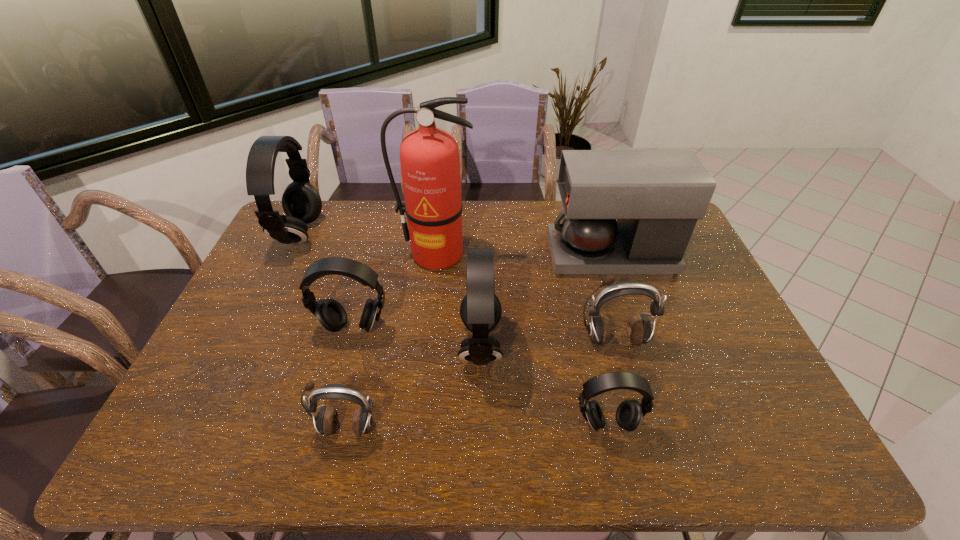
Where is `the smallest black earphone`? This screenshot has width=960, height=540. the smallest black earphone is located at coordinates (629, 413).

The height and width of the screenshot is (540, 960). Identify the location of the nearest black earphone. (629, 413).

Where is `the left brown earphone`? the left brown earphone is located at coordinates (326, 421).

Locate an element on the screen. Image resolution: width=960 pixels, height=540 pixels. the nearer brown earphone is located at coordinates [x=326, y=421].

The width and height of the screenshot is (960, 540). What are the coordinates of `vacant region located 0.290m on the side of the red fire extinguisher with the nozzle and handle` in the screenshot? It's located at (426, 343).

This screenshot has width=960, height=540. I want to click on free spot located on the ear cups of the tallest earphone, so click(x=371, y=235).

Find the location of a particular element. vacant position located 0.180m on the carafe side of the coffee maker is located at coordinates (496, 255).

The width and height of the screenshot is (960, 540). I want to click on free spot located 0.280m on the carafe side of the coffee maker, so click(467, 255).

The width and height of the screenshot is (960, 540). I want to click on vacant space located 0.210m on the carafe side of the coffee maker, so click(x=488, y=255).

Locate an element on the screen. This screenshot has height=540, width=960. free spot located on the ear cups of the fifth shortest earphone is located at coordinates (419, 345).